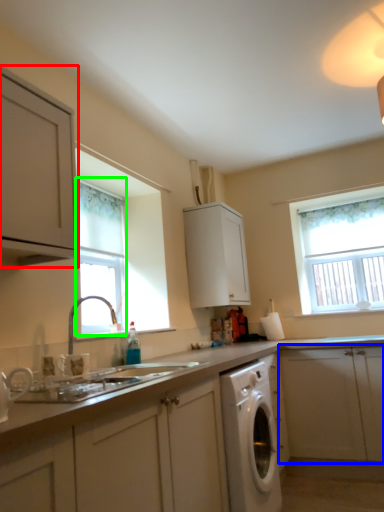
Question: Which is farther away from cabinetry (highlighted by a red box)? cabinetry (highlighted by a blue box) or window (highlighted by a green box)?

Choices:
 (A) cabinetry
 (B) window

Answer: (A)